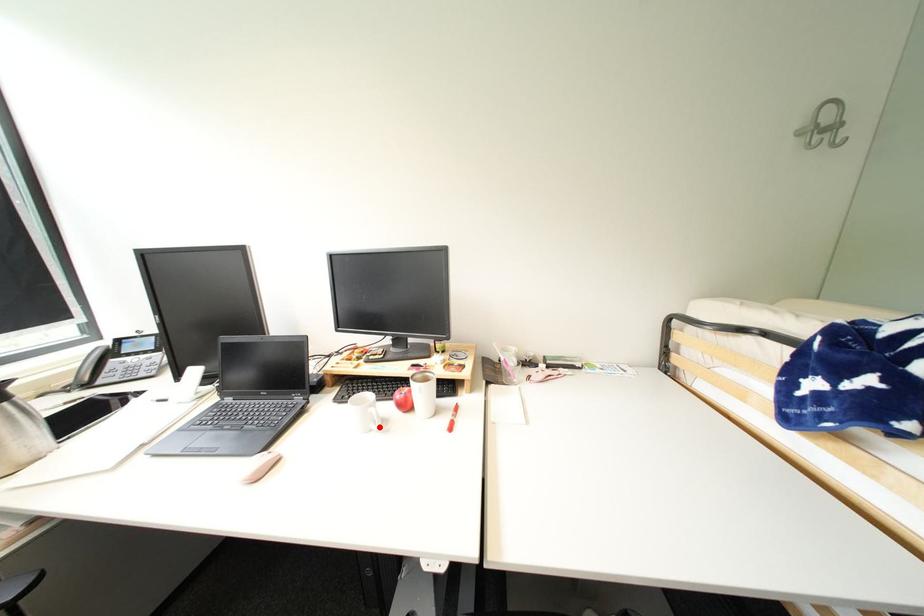
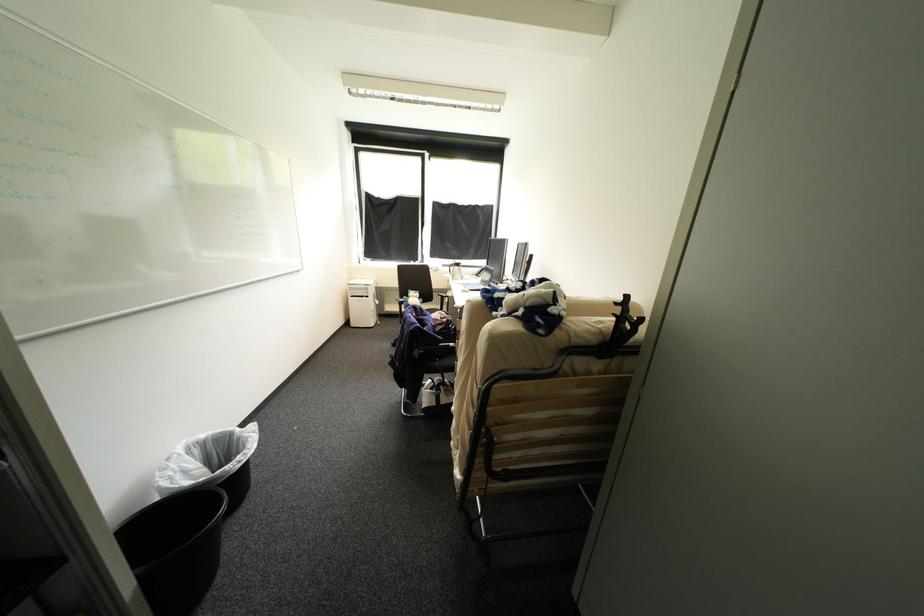
Question: I am providing you with two images of the same scene from different viewpoints. A red point is marked on the first image. Is the red point's position out of view in image 2?

Choices:
 (A) Yes
 (B) No

Answer: (A)